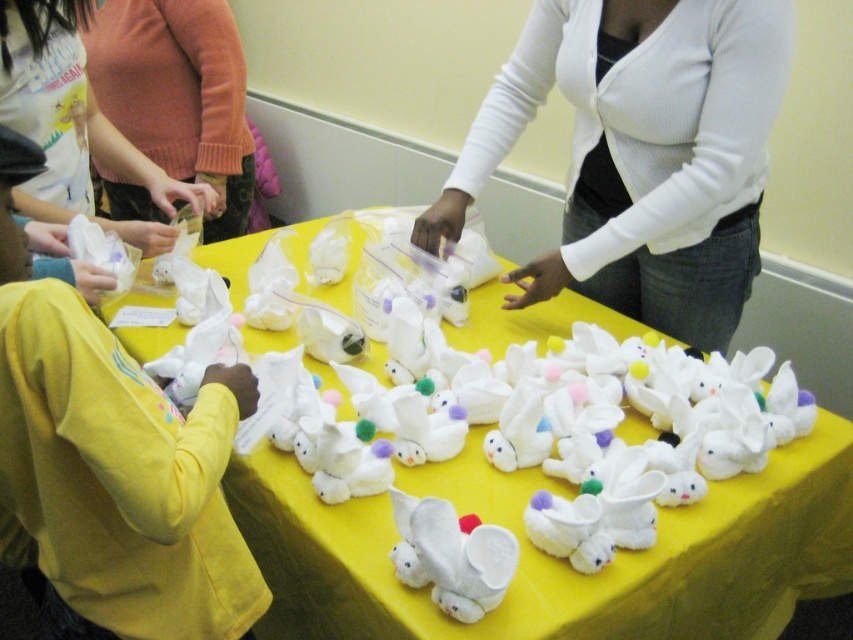
Between point (718, 486) and point (431, 516), which one is positioned in front?

Point (431, 516) is more forward.

Locate an element on the screen. The image size is (853, 640). white plush bunnies at center is located at coordinates (556, 560).

Who is more forward, (827, 440) or (39, 61)?

Positioned in front is point (827, 440).

Describe the element at coordinates (556, 560) in the screenshot. The height and width of the screenshot is (640, 853). I see `white plush bunnies at center` at that location.

Which is in front, point (482, 429) or point (53, 51)?

Point (482, 429)

Locate an element on the screen. white plush bunnies at center is located at coordinates (556, 560).

Between point (674, 54) and point (10, 51), which one is positioned in front?

Positioned in front is point (10, 51).

Is point (691, 144) less distant than point (78, 61)?

Yes, it is.

This screenshot has height=640, width=853. In order to click on white ribbed sweater at upper center in this screenshot , I will do `click(641, 154)`.